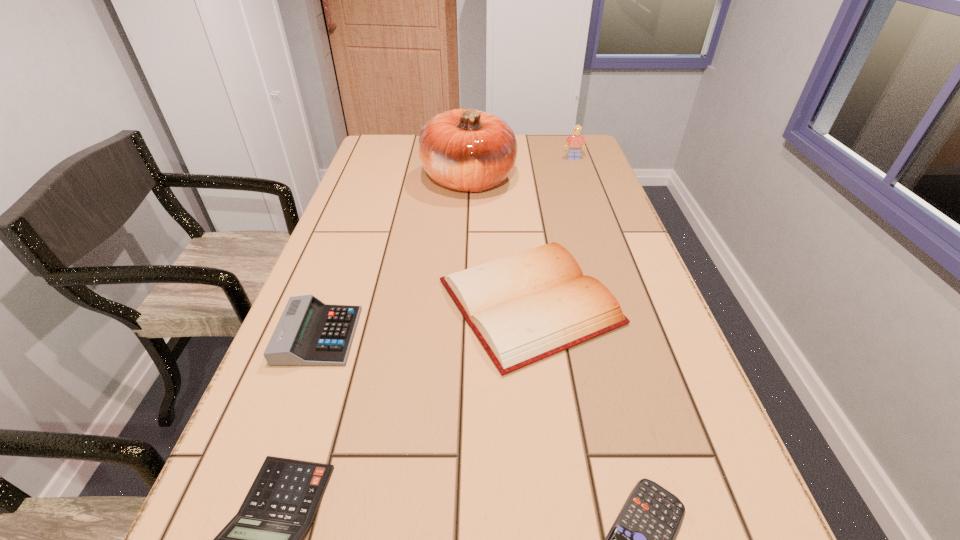
You are a GUI agent. You are given a task and a screenshot of the screen. Output one action in this format:
    pyautogui.click(x=<x>, y=<y>)
    Task: Click on the object situated at the left edge
    This screenshot has height=540, width=960.
    Given the screenshot: What is the action you would take?
    pyautogui.click(x=309, y=333)

Locate an element on the screen. The height and width of the screenshot is (540, 960). Lego positioned at the right edge is located at coordinates (576, 141).

You are a GUI agent. You are given a task and a screenshot of the screen. Output one action in this format:
    pyautogui.click(x=<x>, y=<y>)
    Task: Click on the Bible situated at the right edge
    This screenshot has height=540, width=960.
    Given the screenshot: What is the action you would take?
    pyautogui.click(x=525, y=307)

Locate an element on the screen. This screenshot has width=960, height=540. object at the far right corner is located at coordinates (576, 141).

At what (x,y) coordinates should I click in order to perform the action: click on free region at the left edge of the desktop. Please return your answer as a coordinate pair (x, y). Looking at the image, I should click on (304, 371).

This screenshot has width=960, height=540. In order to click on vacant space at the right edge in this screenshot , I will do `click(618, 206)`.

Find the location of a particular element. vacant area at the far left corner of the desktop is located at coordinates (385, 136).

Where is `free space at the far right corner`? The image size is (960, 540). free space at the far right corner is located at coordinates (550, 141).

The height and width of the screenshot is (540, 960). What are the coordinates of `free point between the Bible and the pumpkin` in the screenshot? It's located at (499, 241).

The width and height of the screenshot is (960, 540). Identify the location of free space between the second tallest object and the pumpkin. (521, 169).